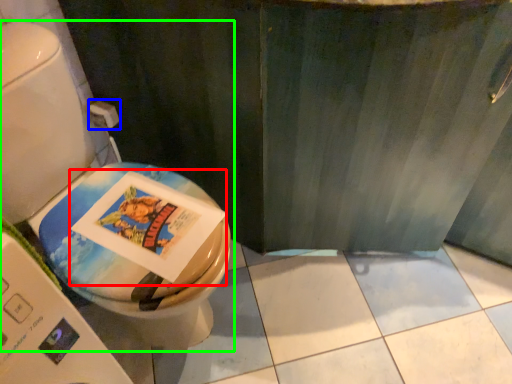
Question: Which object is the farthest from comic book (highlighted by a red box)? Choose among these: toilet paper (highlighted by a blue box) or toilet (highlighted by a green box).

Choices:
 (A) toilet paper
 (B) toilet

Answer: (A)